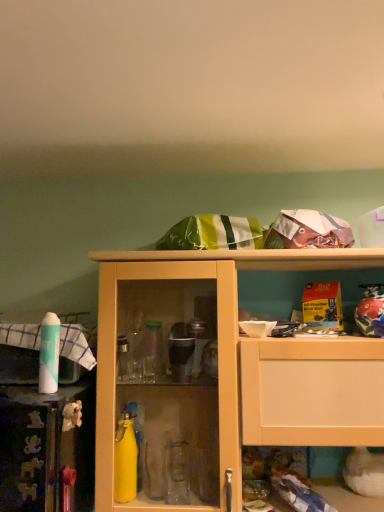
The height and width of the screenshot is (512, 384). What do you see at coordinates (49, 354) in the screenshot?
I see `white matte spray can at left` at bounding box center [49, 354].

Measure the distance between white matte spray can at left and camera.

white matte spray can at left is 1.11 meters from camera.

Find the location of a particular element. white matte spray can at left is located at coordinates (49, 354).

In order to face matte yellow cabinet at center, should I rotate leftwards or rightwards?

To face it directly, rotate right by 8.006 degrees.

The width and height of the screenshot is (384, 512). What do you see at coordinates (219, 375) in the screenshot? I see `matte yellow cabinet at center` at bounding box center [219, 375].

At what (x,y) coordinates should I click in order to perform the action: click on matte yellow cabinet at center. Please return your answer as a coordinate pair (x, y). Looking at the image, I should click on (219, 375).

You are a GUI agent. You are given a task and a screenshot of the screen. Output one action in this format:
    pyautogui.click(x=<x>, y=<y>)
    Task: Click on the white matte spray can at left
    Image resolution: width=384 pixels, height=512 pixels.
    Given the screenshot: What is the action you would take?
    pyautogui.click(x=49, y=354)

Is white matte spray can at left at the right side of matte yellow cabinet at center?

Incorrect, white matte spray can at left is not on the right side of matte yellow cabinet at center.

Does white matte spray can at left come behind matte yellow cabinet at center?

Yes, white matte spray can at left is further from the camera.

Which is nearer, (59, 326) or (116, 402)?

Clearly, point (59, 326) is closer to the camera than point (116, 402).

From the image's perspective, between white matte spray can at left and matte yellow cabinet at center, which one is located above?

white matte spray can at left, from the image's perspective.

From a real-world perspective, is white matte spray can at left positioned above or below matte yellow cabinet at center?

white matte spray can at left is situated higher than matte yellow cabinet at center in the real world.

Which object is thinner, white matte spray can at left or matte yellow cabinet at center?

Thinner between the two is white matte spray can at left.

In terms of height, does white matte spray can at left look taller or shorter compared to matte yellow cabinet at center?

Clearly, white matte spray can at left is shorter compared to matte yellow cabinet at center.

Does white matte spray can at left have a larger size compared to matte yellow cabinet at center?

Incorrect, white matte spray can at left is not larger than matte yellow cabinet at center.

Is white matte spray can at left inside the boundaries of matte yellow cabinet at center, or outside?

white matte spray can at left lies outside matte yellow cabinet at center.

Are white matte spray can at left and matte yellow cabinet at center located far from each other?

They are positioned close to each other.

Could you tell me if white matte spray can at left is facing matte yellow cabinet at center?

No, white matte spray can at left does not turn towards matte yellow cabinet at center.

What's the angular difference between white matte spray can at left and matte yellow cabinet at center's facing directions?

The facing directions of white matte spray can at left and matte yellow cabinet at center are 7.97e-05 degrees apart.

Measure the distance from white matte spray can at left to matte yellow cabinet at center.

A distance of 17.04 inches exists between white matte spray can at left and matte yellow cabinet at center.

What are the coordinates of `cabinetry located underneath the white matte spray can at left (from a real-world perspective)` in the screenshot? It's located at (219, 375).

Which object is positioned more to the right, matte yellow cabinet at center or white matte spray can at left?

Positioned to the right is matte yellow cabinet at center.

In the image, is matte yellow cabinet at center positioned in front of or behind white matte spray can at left?

Visually, matte yellow cabinet at center is located in front of white matte spray can at left.

Does point (302, 388) appear closer or farther from the camera than point (59, 329)?

Point (302, 388) appears to be closer to the viewer than point (59, 329).

From the image's perspective, who appears lower, matte yellow cabinet at center or white matte spray can at left?

matte yellow cabinet at center.

From a real-world perspective, which object rests below the other?

In real-world perspective, matte yellow cabinet at center is lower.

Is matte yellow cabinet at center thinner than white matte spray can at left?

In fact, matte yellow cabinet at center might be wider than white matte spray can at left.

Does matte yellow cabinet at center have a greater height compared to white matte spray can at left?

Yes.

Between matte yellow cabinet at center and white matte spray can at left, which one has larger size?

Bigger between the two is matte yellow cabinet at center.

Is white matte spray can at left completely or partially inside matte yellow cabinet at center?

No, white matte spray can at left is not inside matte yellow cabinet at center.

Would you say matte yellow cabinet at center is a long distance from white matte spray can at left?

matte yellow cabinet at center is near white matte spray can at left, not far away.

Is white matte spray can at left at the back of matte yellow cabinet at center?

matte yellow cabinet at center is not turned away from white matte spray can at left.

Can you tell me how much matte yellow cabinet at center and white matte spray can at left differ in facing direction?

7.97e-05 degrees separate the facing orientations of matte yellow cabinet at center and white matte spray can at left.

Where is `cabinetry below the white matte spray can at left (from a real-world perspective)`? The height and width of the screenshot is (512, 384). cabinetry below the white matte spray can at left (from a real-world perspective) is located at coordinates (219, 375).

Locate an element on the screen. This screenshot has height=512, width=384. bottle behind the matte yellow cabinet at center is located at coordinates (49, 354).

Where is `cabinetry located in front of the white matte spray can at left`? Image resolution: width=384 pixels, height=512 pixels. cabinetry located in front of the white matte spray can at left is located at coordinates (219, 375).